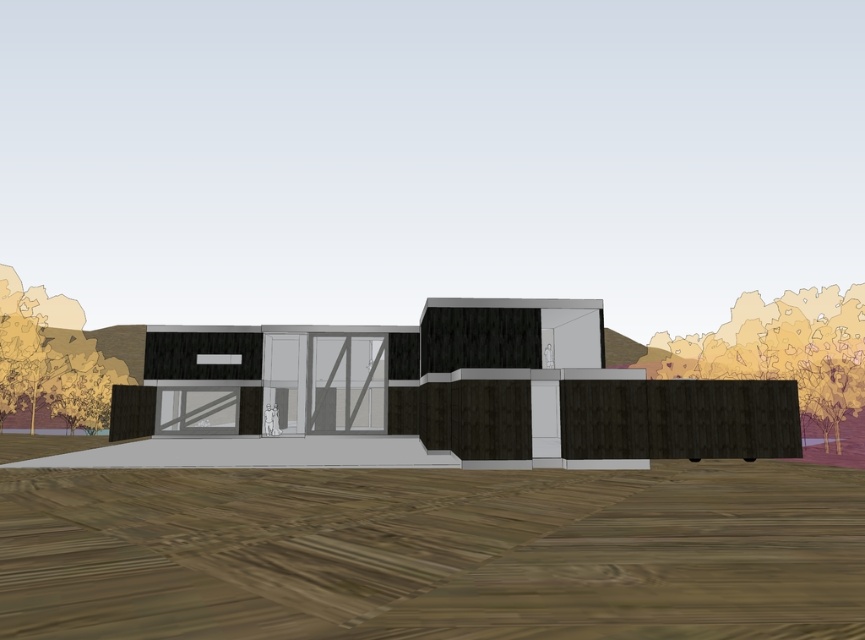
Question: Among these points, which one is nearest to the camera?

Choices:
 (A) (13, 310)
 (B) (779, 356)

Answer: (B)

Question: Which of the following is the farthest from the observer?

Choices:
 (A) brown wood fence at right
 (B) yellow leafy tree at left

Answer: (B)

Question: Does brown wood fence at right have a smaller size compared to yellow leafy tree at left?

Choices:
 (A) no
 (B) yes

Answer: (B)

Question: Which point is farther to the camera?

Choices:
 (A) yellow leafy tree at left
 (B) brown wood fence at right

Answer: (A)

Question: Can you confirm if brown wood fence at right is positioned below yellow leafy tree at left?

Choices:
 (A) yes
 (B) no

Answer: (A)

Question: Does brown wood fence at right have a larger size compared to yellow leafy tree at left?

Choices:
 (A) yes
 (B) no

Answer: (B)